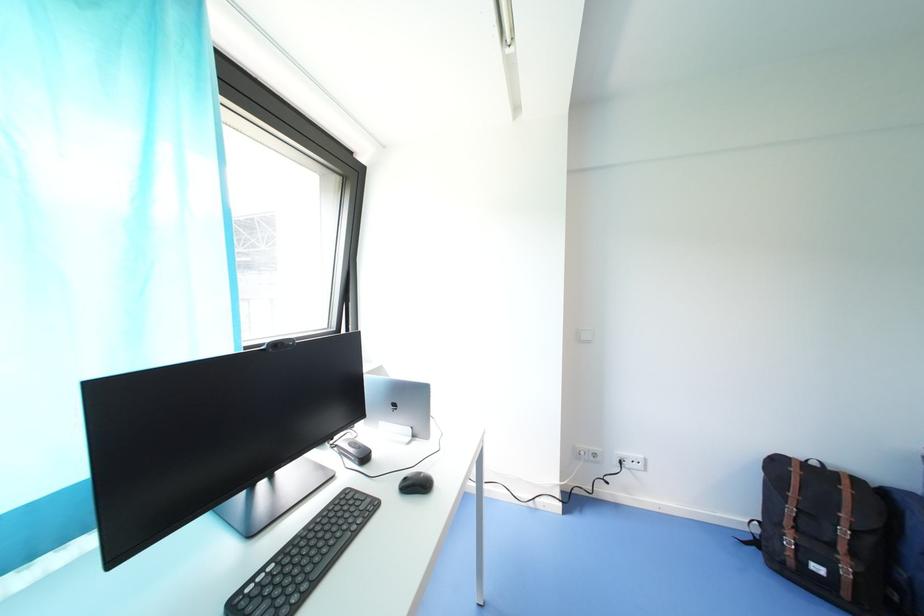
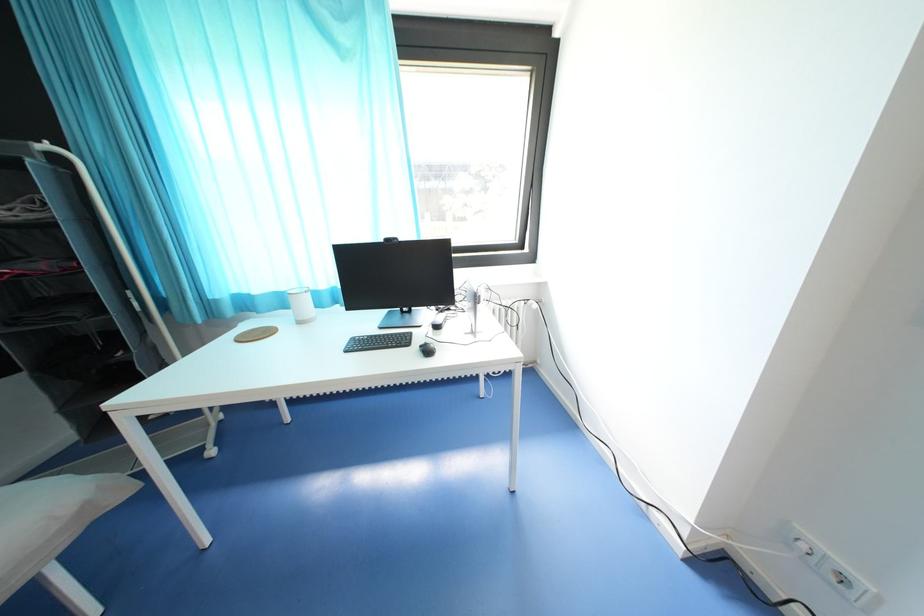
Based on the continuous images, in which direction is the camera rotating?

The camera rotated toward left-down.